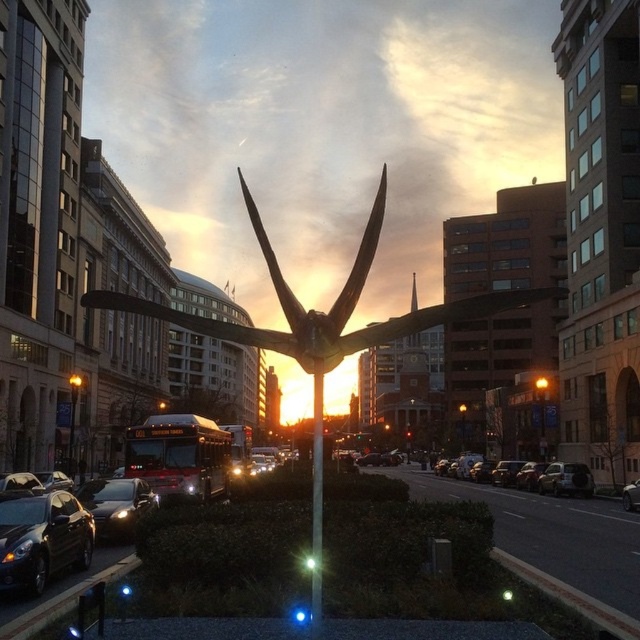
You are a delivery driver who needs to park your truck between the silver metallic sedan at center and the shiny silver car at center. Your truck is 5.5 meters long. Can you fit your truck between them?

The distance between the silver metallic sedan at center and the shiny silver car at center is 5.60 meters. Since your truck is 5.5 meters long, it can fit between them with a small amount of space remaining.

You are a pedestrian standing on the sidewalk near the silver metallic sedan at center and the shiny silver car at center. Which vehicle is positioned lower relative to the other?

The silver metallic sedan at center is positioned below the shiny silver car at center.